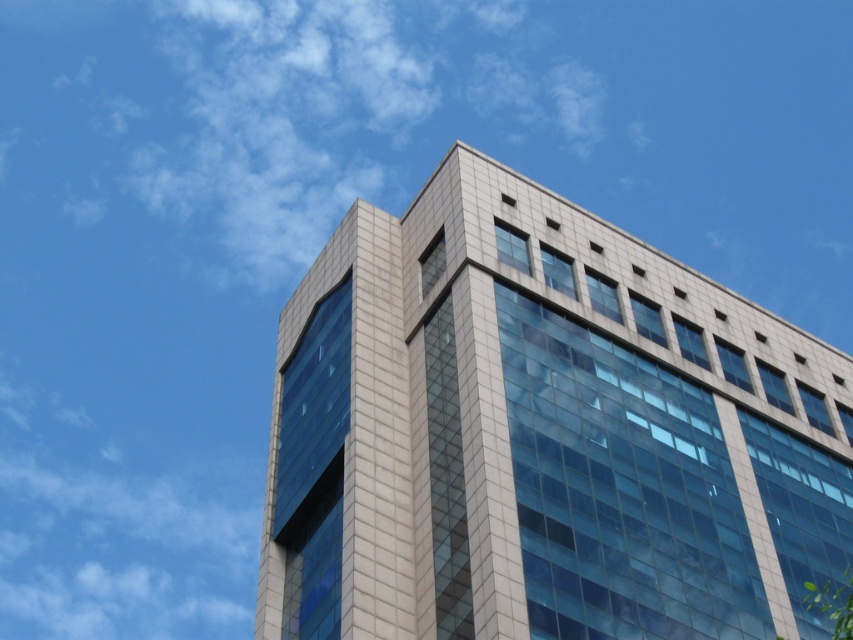
Between gray tile building at center and green leafy tree at lower right, which one is positioned lower?

Positioned lower is green leafy tree at lower right.

Between point (598, 292) and point (828, 586), which one is positioned in front?

Point (828, 586) is more forward.

Find the location of a particular element. Image resolution: width=853 pixels, height=640 pixels. gray tile building at center is located at coordinates (543, 435).